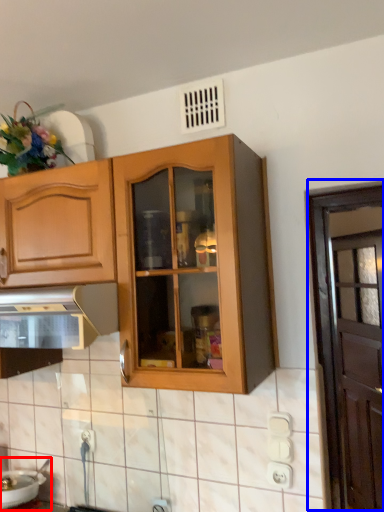
Question: Which of the following is the farthest to the observer, sink (highlighted by a red box) or door (highlighted by a blue box)?

Choices:
 (A) sink
 (B) door

Answer: (B)